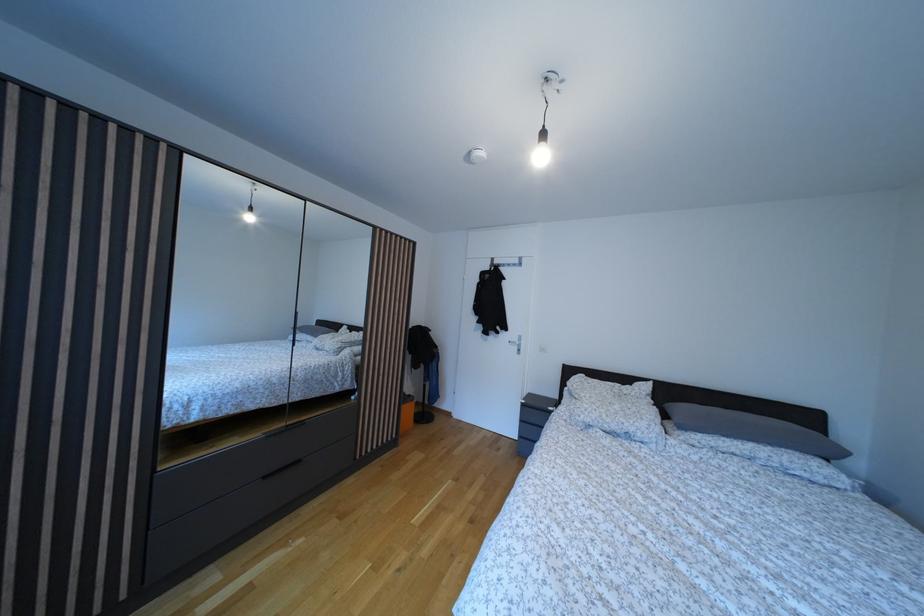
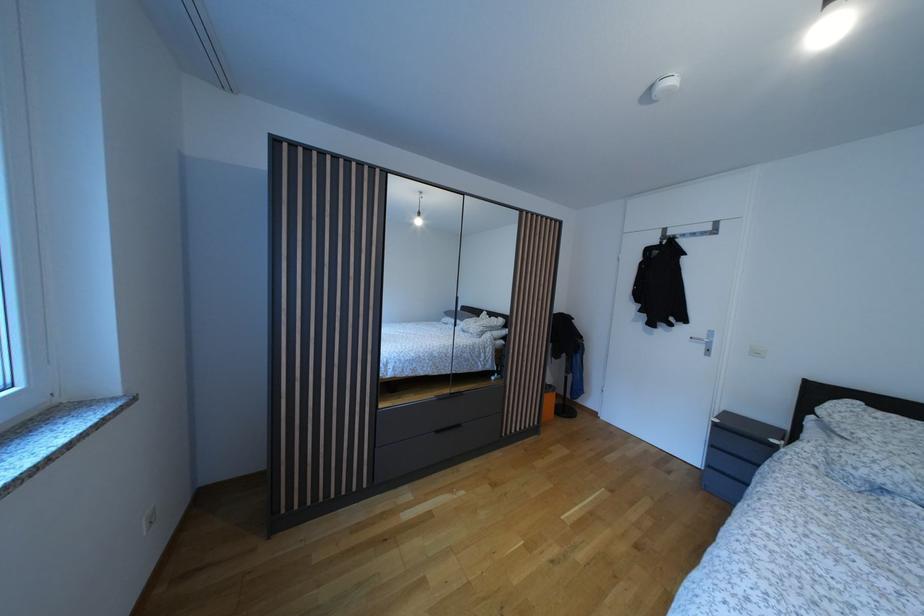
In the second image, find the point that corresponds to point 529,408 in the first image.

(723, 427)